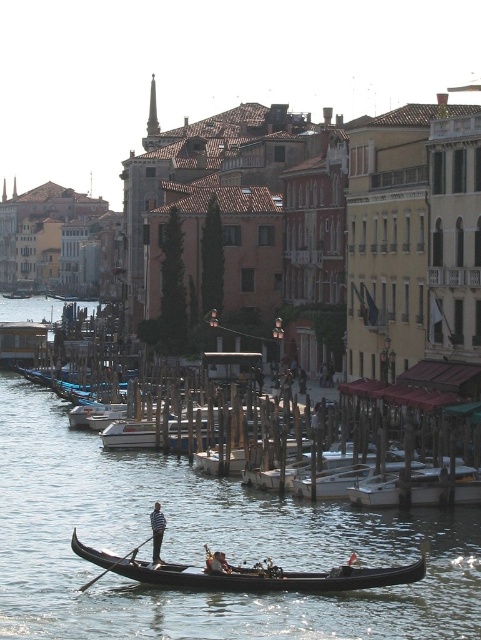
Question: Which point appears farthest from the camera in this image?

Choices:
 (A) coord(308,577)
 (B) coord(95,579)
 (C) coord(367,481)

Answer: (C)

Question: Is the position of dark brown leather oarsman at center less distant than that of black wood paddle at lower center?

Choices:
 (A) no
 (B) yes

Answer: (A)

Question: Estimate the real-world distances between objects in this image. Which object is farther from the dark brown leather oarsman at center?

Choices:
 (A) white wooden dock at center
 (B) black polished wood gondola at lower center
 (C) smooth brown leather oar at lower center
 (D) wooden docked boats at center

Answer: (A)

Question: Does white wooden dock at center have a smaller size compared to black wood paddle at lower center?

Choices:
 (A) yes
 (B) no

Answer: (A)

Question: Which of the following is the farthest from the observer?

Choices:
 (A) (49, 490)
 (B) (164, 584)

Answer: (A)

Question: Does wooden docked boats at center lie in front of dark brown leather oarsman at center?

Choices:
 (A) no
 (B) yes

Answer: (B)